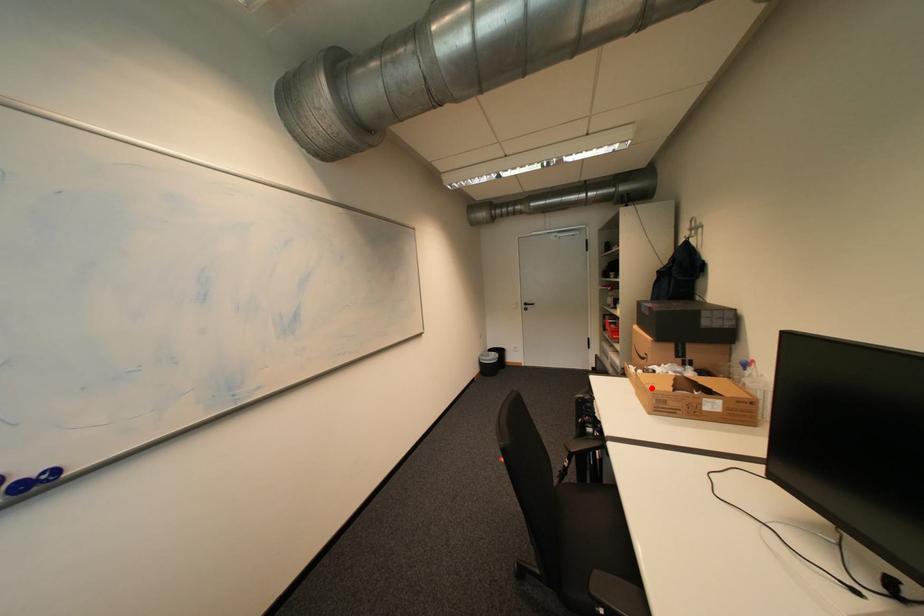
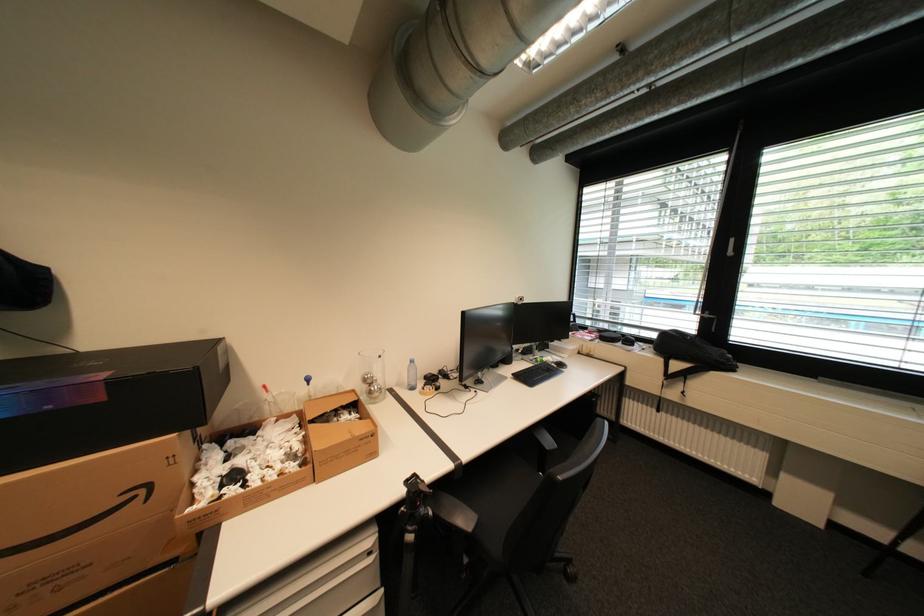
Question: A red point is marked in image1. In image2, is the corresponding 3D point closer to the camera or farther? Reply with the corresponding letter.

Choices:
 (A) The corresponding 3D point is closer.
 (B) The corresponding 3D point is farther.

Answer: (B)